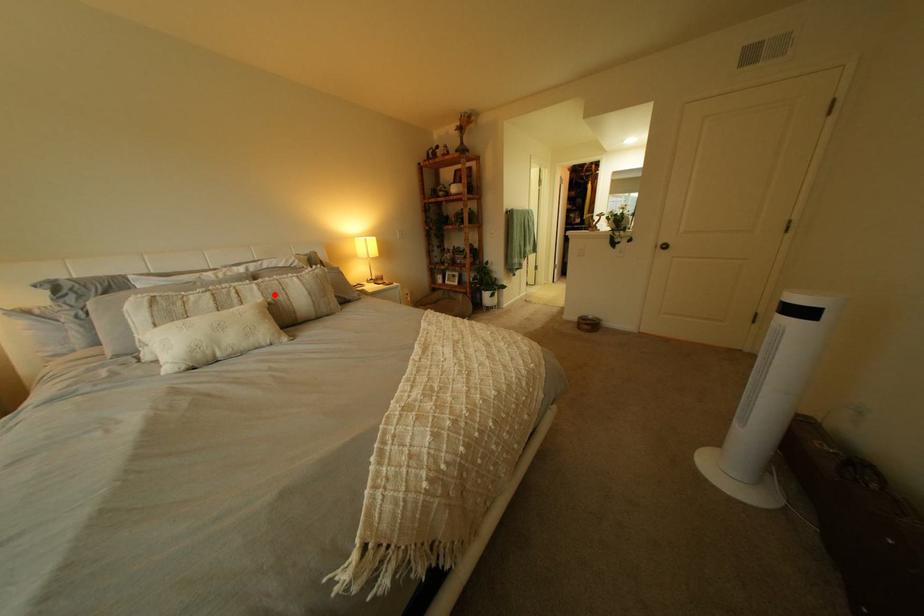
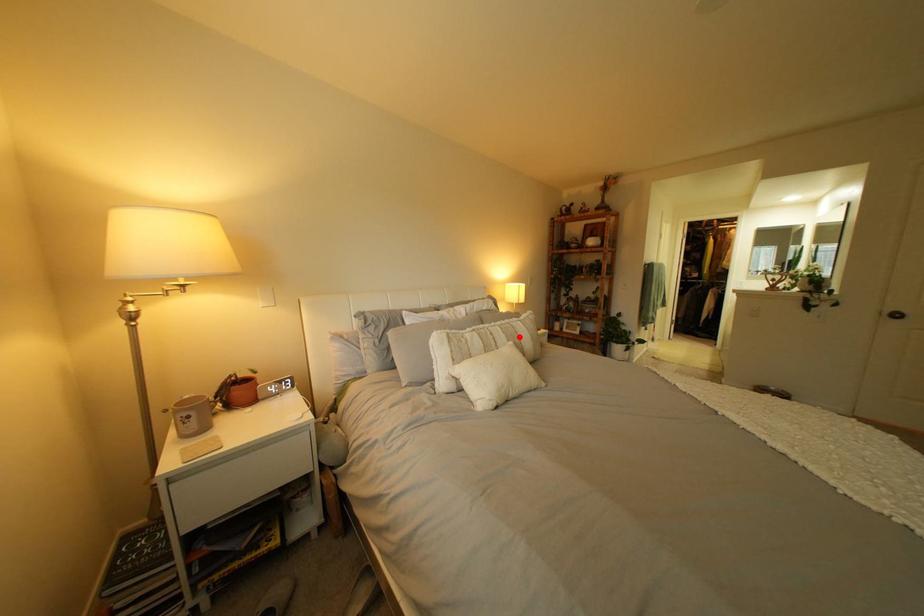
I am providing you with two images of the same scene from different viewpoints. A red point is marked on the first image and another point is marked on the second image. Is the marked point in image1 the same physical position as the marked point in image2?

Yes